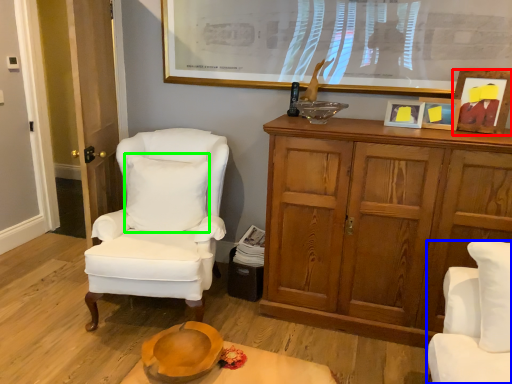
Question: Which is farther away from picture frame (highlighted by a red box)? chair (highlighted by a blue box) or pillow (highlighted by a green box)?

Choices:
 (A) chair
 (B) pillow

Answer: (B)